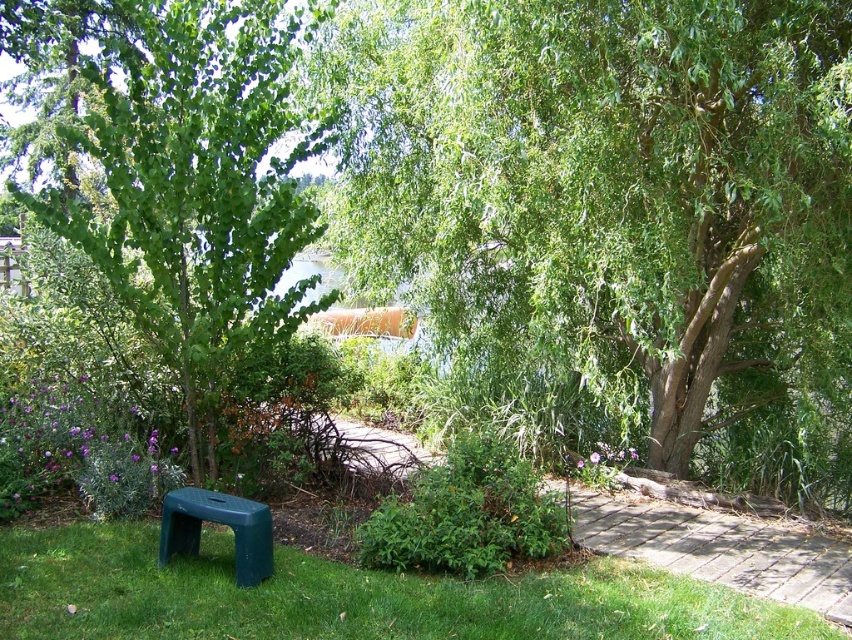
Question: Is brick paved path at center smaller than green plastic bench at lower left?

Choices:
 (A) yes
 (B) no

Answer: (B)

Question: Which point is farther to the camera?

Choices:
 (A) green leafy tree at left
 (B) green leafy tree at upper right

Answer: (A)

Question: Does green leafy tree at upper right appear on the left side of green leafy tree at left?

Choices:
 (A) yes
 (B) no

Answer: (B)

Question: Which point is closer to the camera?

Choices:
 (A) green leafy tree at left
 (B) brick paved path at center

Answer: (B)

Question: Which of these objects is positioned farthest from the green grass at lower left?

Choices:
 (A) brick paved path at center
 (B) green leafy tree at left

Answer: (B)

Question: Does green leafy tree at upper right have a greater width compared to green grass at lower left?

Choices:
 (A) yes
 (B) no

Answer: (A)